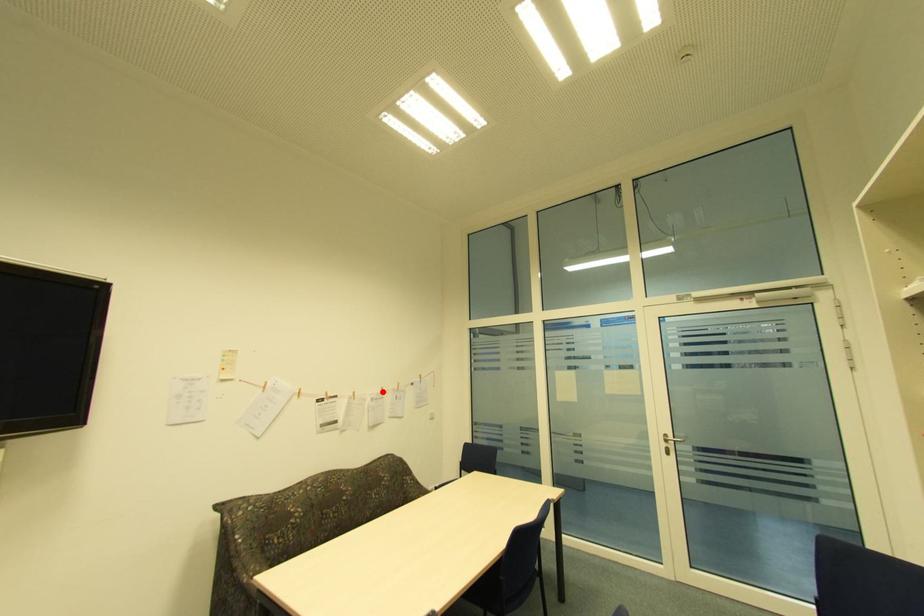
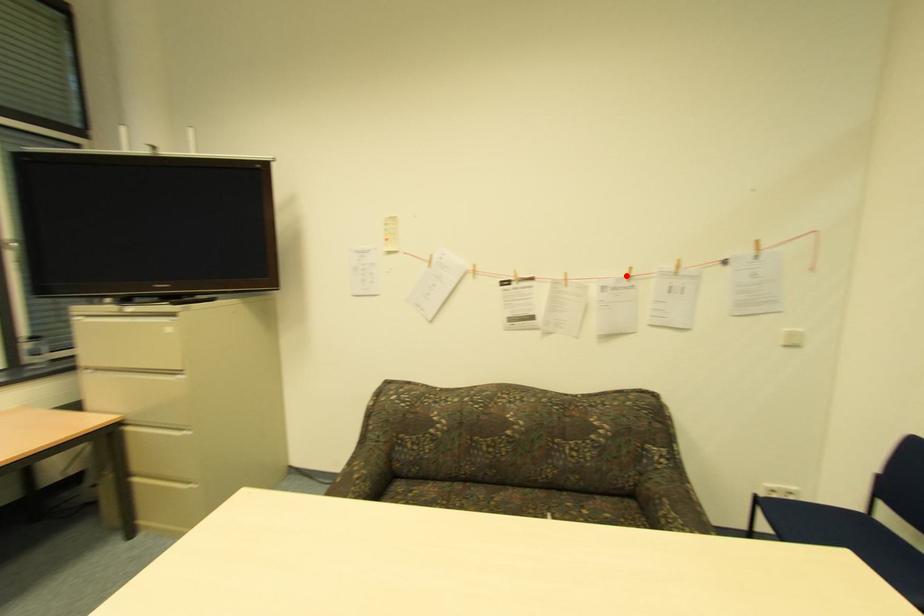
I am providing you with two images of the same scene from different viewpoints. A red point is marked on the first image and another point is marked on the second image. Is the marked point in image1 the same physical position as the marked point in image2?

Yes